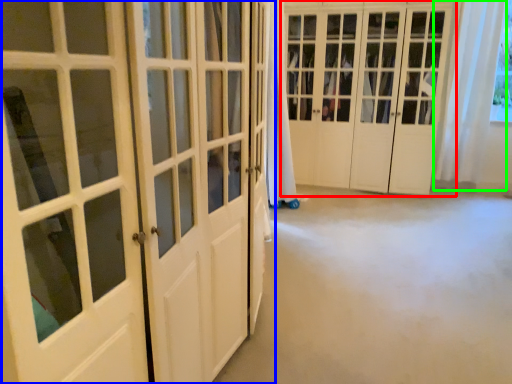
Question: Which object is positioned closest to door (highlighted by a red box)? Select from door (highlighted by a blue box) and curtain (highlighted by a green box).

Choices:
 (A) door
 (B) curtain

Answer: (B)